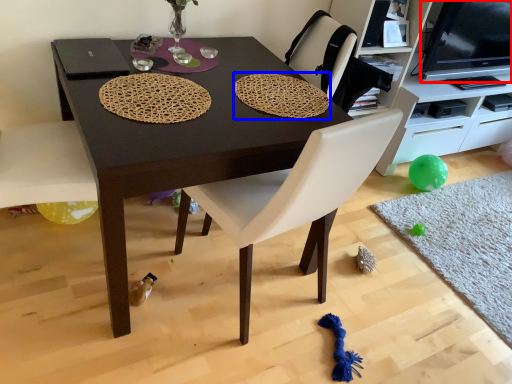
Question: Among these objects, which one is nearest to the camera, television (highlighted by a red box) or mat (highlighted by a blue box)?

Choices:
 (A) television
 (B) mat

Answer: (B)